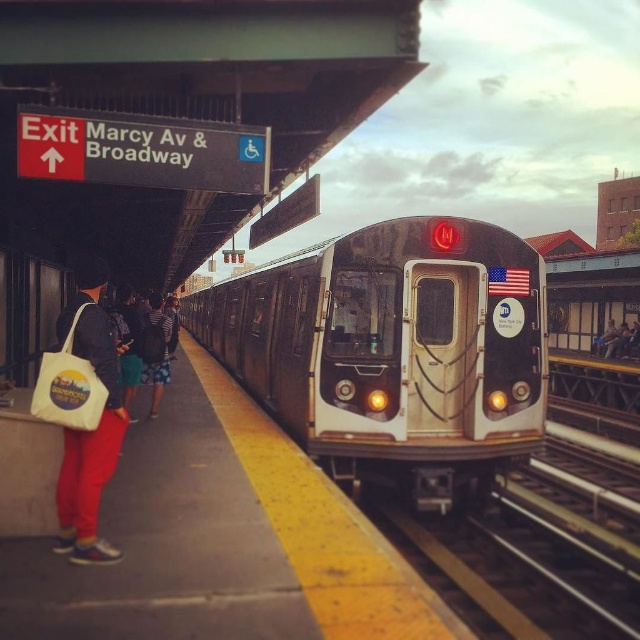
Based on the coordinates provided, which object in the scene corresponds to the point at location (394, 349)?

The silver metallic train at center corresponds to the point at location (394, 349).